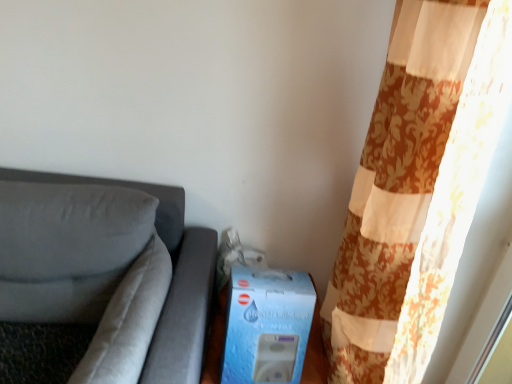
Question: Can you confirm if suede gray couch at left is positioned to the left of floral fabric curtain at right?

Choices:
 (A) yes
 (B) no

Answer: (A)

Question: Is suede gray couch at left further to the viewer compared to floral fabric curtain at right?

Choices:
 (A) yes
 (B) no

Answer: (B)

Question: Considering the relative sizes of suede gray couch at left and floral fabric curtain at right in the image provided, is suede gray couch at left taller than floral fabric curtain at right?

Choices:
 (A) yes
 (B) no

Answer: (B)

Question: Is suede gray couch at left positioned before floral fabric curtain at right?

Choices:
 (A) no
 (B) yes

Answer: (B)

Question: From a real-world perspective, is suede gray couch at left under floral fabric curtain at right?

Choices:
 (A) no
 (B) yes

Answer: (B)

Question: Is suede gray couch at left in front of or behind suede-like gray pillow at left in the image?

Choices:
 (A) behind
 (B) front

Answer: (B)

Question: Considering the relative positions of suede gray couch at left and suede-like gray pillow at left in the image provided, is suede gray couch at left to the left or to the right of suede-like gray pillow at left?

Choices:
 (A) right
 (B) left

Answer: (B)

Question: From a real-world perspective, is suede gray couch at left physically located above or below suede-like gray pillow at left?

Choices:
 (A) above
 (B) below

Answer: (B)

Question: In terms of size, does suede gray couch at left appear bigger or smaller than suede-like gray pillow at left?

Choices:
 (A) small
 (B) big

Answer: (B)

Question: In the image, is suede-like gray pillow at left positioned in front of or behind blue cardboard box at lower center?

Choices:
 (A) front
 (B) behind

Answer: (A)

Question: From the image's perspective, is suede-like gray pillow at left positioned above or below blue cardboard box at lower center?

Choices:
 (A) below
 (B) above

Answer: (B)

Question: From their relative heights in the image, would you say suede-like gray pillow at left is taller or shorter than blue cardboard box at lower center?

Choices:
 (A) tall
 (B) short

Answer: (A)

Question: Considering the positions of point (73, 258) and point (269, 314), is point (73, 258) closer or farther from the camera than point (269, 314)?

Choices:
 (A) closer
 (B) farther

Answer: (B)

Question: Is blue cardboard box at lower center wider or thinner than suede-like gray pillow at left?

Choices:
 (A) thin
 (B) wide

Answer: (A)

Question: From a real-world perspective, is blue cardboard box at lower center above or below suede-like gray pillow at left?

Choices:
 (A) above
 (B) below

Answer: (B)